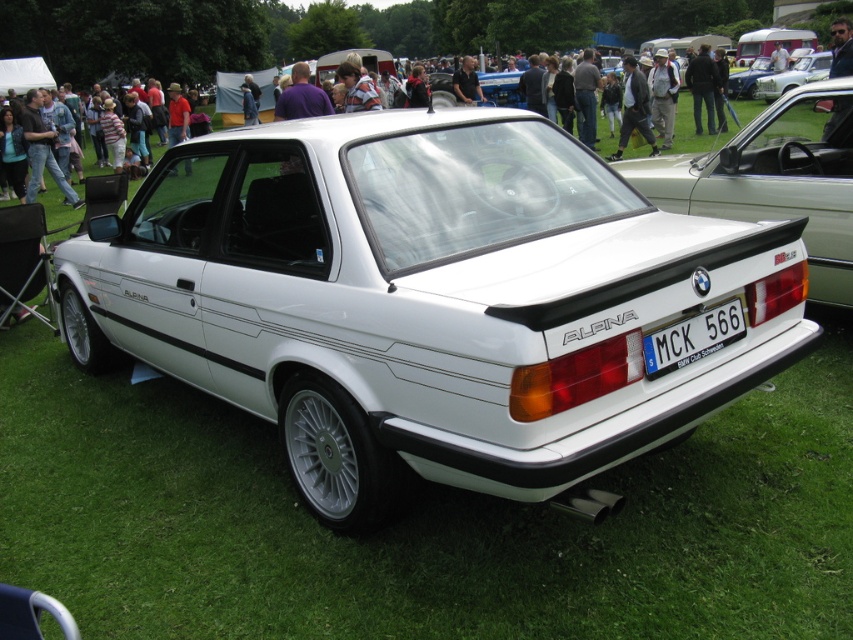
Is white plastic license plate at rear bigger than metallic blue car at upper right?

Actually, white plastic license plate at rear might be smaller than metallic blue car at upper right.

Does white plastic license plate at rear appear on the left side of metallic blue car at upper right?

Yes, white plastic license plate at rear is to the left of metallic blue car at upper right.

Image resolution: width=853 pixels, height=640 pixels. What do you see at coordinates (692, 339) in the screenshot?
I see `white plastic license plate at rear` at bounding box center [692, 339].

This screenshot has width=853, height=640. Find the location of `white plastic license plate at rear`. white plastic license plate at rear is located at coordinates (692, 339).

Which of these two, white matte rear wing at center or white glossy sedan at upper right, stands taller?

With more height is white glossy sedan at upper right.

Can you confirm if white matte rear wing at center is thinner than white glossy sedan at upper right?

Incorrect, white matte rear wing at center's width is not less than white glossy sedan at upper right's.

Who is more forward, (840, 189) or (811, 68)?

Point (840, 189) is more forward.

The height and width of the screenshot is (640, 853). Identify the location of white matte rear wing at center. (775, 179).

Who is more distant from viewer, (279, 416) or (770, 64)?

Point (770, 64)

Between point (221, 333) and point (758, 76), which one is positioned in front?

Point (221, 333)

Image resolution: width=853 pixels, height=640 pixels. Identify the location of white metallic car at center. (427, 300).